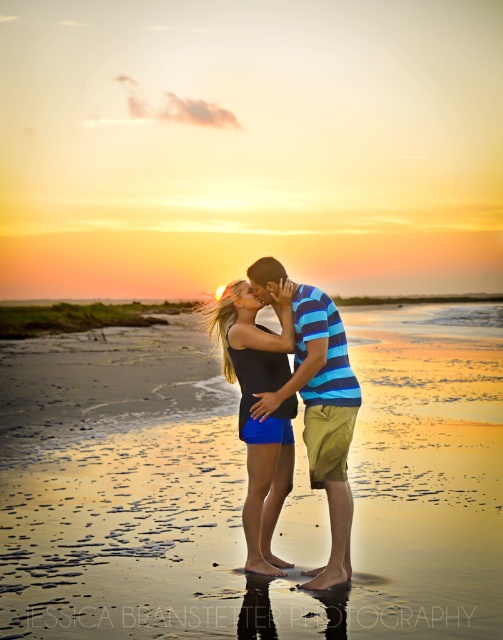
Question: Estimate the real-world distances between objects in this image. Which object is closer to the matte black tank top at center?

Choices:
 (A) sandy beach at center
 (B) striped cotton shirt at center

Answer: (B)

Question: Estimate the real-world distances between objects in this image. Which object is farther from the striped cotton shirt at center?

Choices:
 (A) sandy beach at center
 (B) matte black tank top at center

Answer: (A)

Question: Which object is positioned farthest from the sandy beach at center?

Choices:
 (A) matte black tank top at center
 (B) striped cotton shirt at center

Answer: (B)

Question: Can you confirm if striped cotton shirt at center is positioned below matte black tank top at center?

Choices:
 (A) yes
 (B) no

Answer: (B)

Question: Can you confirm if striped cotton shirt at center is wider than matte black tank top at center?

Choices:
 (A) no
 (B) yes

Answer: (B)

Question: In this image, where is sandy beach at center located relative to matte black tank top at center?

Choices:
 (A) right
 (B) left

Answer: (A)